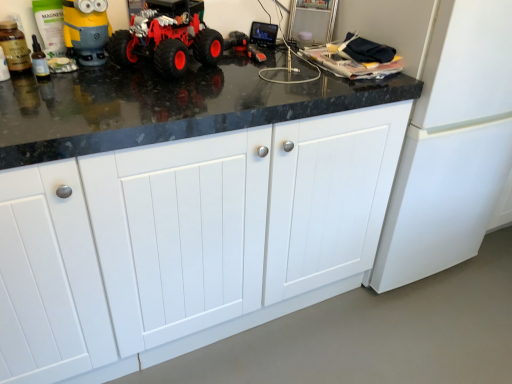
Question: Could red rubber toy truck at center be considered to be inside white matte cabinet at center?

Choices:
 (A) yes
 (B) no

Answer: (B)

Question: Is white matte cabinet at center to the right of red rubber toy truck at center from the viewer's perspective?

Choices:
 (A) yes
 (B) no

Answer: (A)

Question: Is white matte cabinet at center shorter than red rubber toy truck at center?

Choices:
 (A) no
 (B) yes

Answer: (A)

Question: Can you confirm if white matte cabinet at center is smaller than red rubber toy truck at center?

Choices:
 (A) no
 (B) yes

Answer: (A)

Question: Is white matte cabinet at center completely or partially outside of red rubber toy truck at center?

Choices:
 (A) yes
 (B) no

Answer: (A)

Question: Are white matte cabinet at center and red rubber toy truck at center far apart?

Choices:
 (A) yes
 (B) no

Answer: (B)

Question: From a real-world perspective, is red rubber toy truck at center located higher than white matte cabinet at center?

Choices:
 (A) no
 (B) yes

Answer: (B)

Question: Is red rubber toy truck at center not near white matte cabinet at center?

Choices:
 (A) yes
 (B) no

Answer: (B)

Question: Does red rubber toy truck at center contain white matte cabinet at center?

Choices:
 (A) no
 (B) yes

Answer: (A)

Question: From a real-world perspective, is red rubber toy truck at center below white matte cabinet at center?

Choices:
 (A) yes
 (B) no

Answer: (B)

Question: Is red rubber toy truck at center thinner than white matte cabinet at center?

Choices:
 (A) no
 (B) yes

Answer: (B)

Question: From the image's perspective, is red rubber toy truck at center on white matte cabinet at center?

Choices:
 (A) no
 (B) yes

Answer: (B)

Question: From the image's perspective, is red rubber toy truck at center located above or below white matte cabinet at center?

Choices:
 (A) below
 (B) above

Answer: (B)